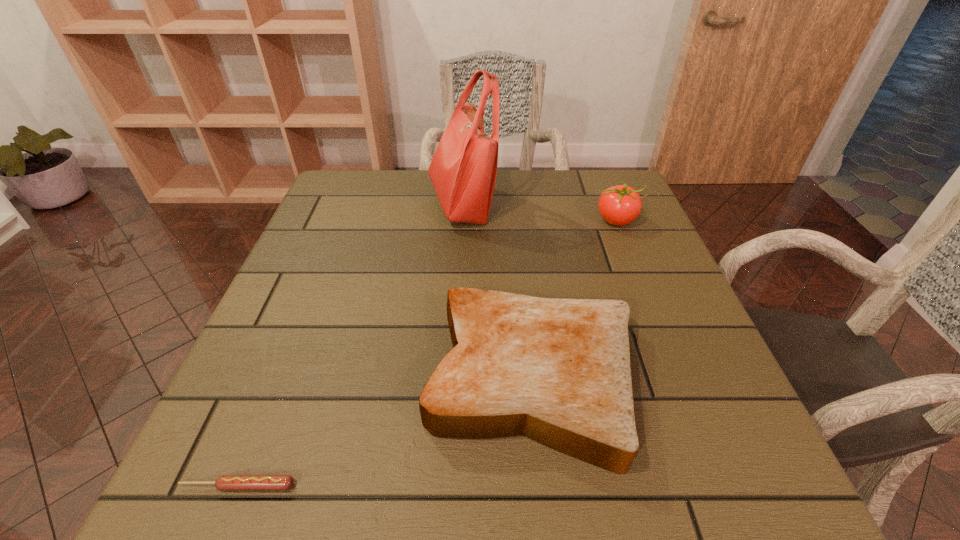
The width and height of the screenshot is (960, 540). Identify the location of free space that is in between the second tallest object and the leftmost object. (427, 353).

I want to click on vacant space that is in between the rightmost object and the handbag, so click(539, 212).

I want to click on vacant area between the tallest object and the third shortest object, so click(539, 212).

The image size is (960, 540). I want to click on free spot between the tallest object and the leftmost object, so click(349, 345).

Image resolution: width=960 pixels, height=540 pixels. I want to click on free point between the tomato and the handbag, so click(x=539, y=212).

You are a GUI agent. You are given a task and a screenshot of the screen. Output one action in this format:
    pyautogui.click(x=<x>, y=<y>)
    Task: Click on the object that can be found as the closest to the handbag
    This screenshot has height=540, width=960.
    Given the screenshot: What is the action you would take?
    pyautogui.click(x=619, y=205)

Find the location of a particular element. The image size is (960, 540). object that is the second closest to the second nearest object is located at coordinates (619, 205).

At what (x,y) coordinates should I click in order to perform the action: click on vacant region that satisfies the following two spatial constraints: 1. on the front-facing side of the tallest object; 2. on the left side of the tomato. Please return your answer as a coordinate pair (x, y). Looking at the image, I should click on click(x=461, y=220).

Identify the location of free space that satisfies the following two spatial constraints: 1. on the front-facing side of the tomato; 2. on the left side of the tallest object. (461, 220).

Where is `free space that satisfies the following two spatial constraints: 1. on the front-facing side of the tallest object; 2. on the right side of the bread`? This screenshot has height=540, width=960. free space that satisfies the following two spatial constraints: 1. on the front-facing side of the tallest object; 2. on the right side of the bread is located at coordinates (451, 380).